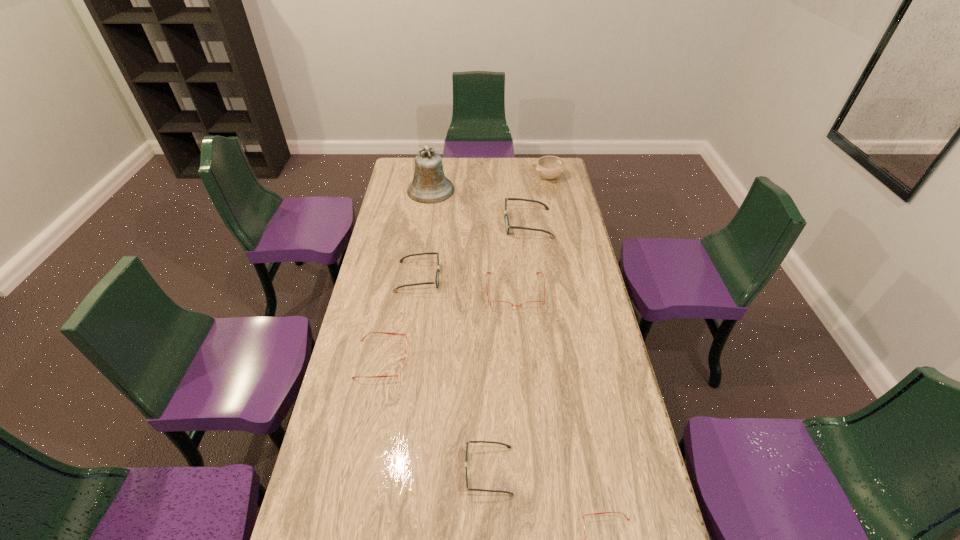
Identify the location of free space located 0.270m on the face of the fifth farthest spectacles. (366, 471).

Where is `vacant space situated 0.080m on the face of the fifth farthest spectacles`? The height and width of the screenshot is (540, 960). vacant space situated 0.080m on the face of the fifth farthest spectacles is located at coordinates (435, 471).

Image resolution: width=960 pixels, height=540 pixels. I want to click on free space located on the lenses of the second biggest pink spectacles, so click(x=492, y=359).

You are a GUI agent. You are given a task and a screenshot of the screen. Output one action in this format:
    pyautogui.click(x=<x>, y=<y>)
    Task: Click on the bell that is at the far edge
    
    Given the screenshot: What is the action you would take?
    pyautogui.click(x=429, y=185)

Identify the location of bowl at the far edge. The image size is (960, 540). (550, 167).

Where is `bell present at the left edge`? Image resolution: width=960 pixels, height=540 pixels. bell present at the left edge is located at coordinates (429, 185).

The image size is (960, 540). What are the coordinates of `bowl present at the right edge` in the screenshot? It's located at (550, 167).

The height and width of the screenshot is (540, 960). I want to click on spectacles present at the right edge, so click(x=507, y=225).

You are a GUI agent. You are given a task and a screenshot of the screen. Output one action in this format:
    pyautogui.click(x=<x>, y=<y>)
    Task: Click on the object positioned at the far left corner
    This screenshot has height=540, width=960.
    Given the screenshot: What is the action you would take?
    pyautogui.click(x=429, y=185)

What are the coordinates of `object at the far right corner` in the screenshot? It's located at (550, 167).